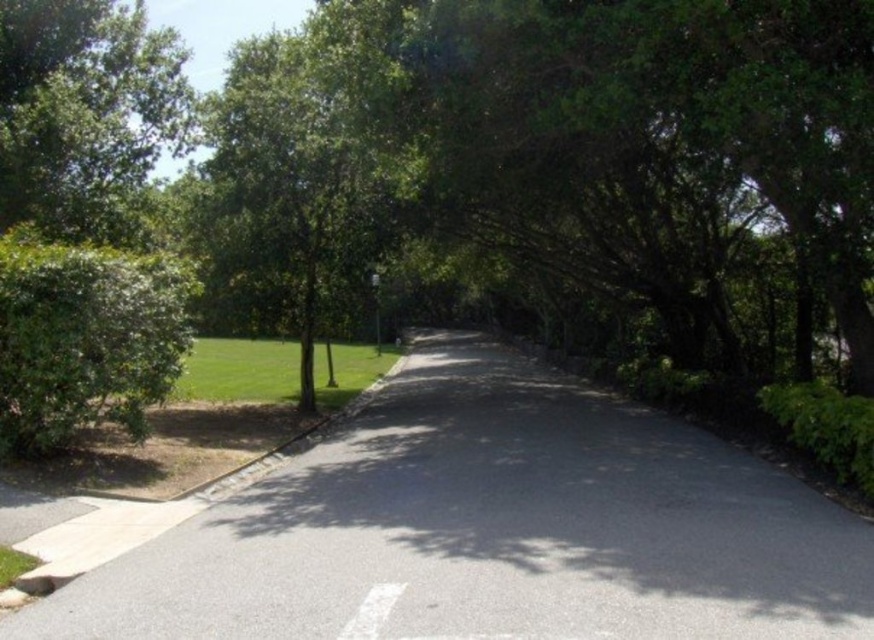
Question: Does smooth asphalt road at center appear under metallic silver street sign at center?

Choices:
 (A) no
 (B) yes

Answer: (B)

Question: Which object is closer to the camera taking this photo?

Choices:
 (A) white asphalt line at center
 (B) smooth asphalt road at center

Answer: (A)

Question: Can you confirm if smooth asphalt road at center is bigger than white asphalt line at center?

Choices:
 (A) no
 (B) yes

Answer: (B)

Question: Considering the real-world distances, which object is farthest from the white asphalt line at center?

Choices:
 (A) metallic silver street sign at center
 (B) smooth asphalt road at center

Answer: (A)

Question: Does white asphalt line at center appear on the left side of metallic silver street sign at center?

Choices:
 (A) yes
 (B) no

Answer: (B)

Question: Which of the following is the farthest from the observer?

Choices:
 (A) metallic silver street sign at center
 (B) white asphalt line at center
 (C) smooth asphalt road at center

Answer: (A)